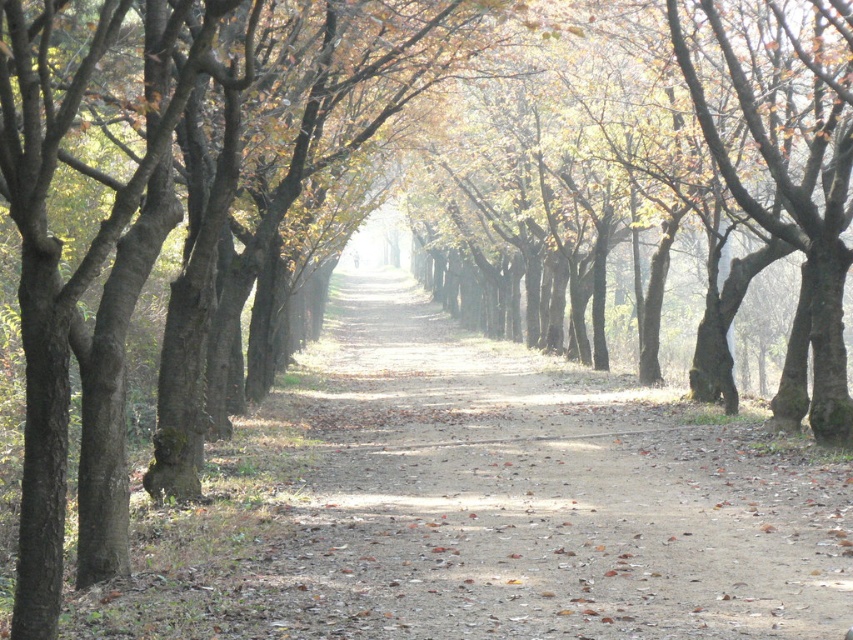
You are a hiker walking along the dirt path at center and want to take a photo of the brown smooth tree at center. Where should you position yourself relative to the tree to capture it in the frame?

The dirt path at center is located below the brown smooth tree at center, so to capture the tree in the frame, you should position yourself on the path below the tree and look upward.

You are a hiker who wants to know if you can walk along the dirt path at center without hitting the brown rough bark tree at right. Can you do that?

The dirt path at center is shorter than the brown rough bark tree at right, so the path is narrower than the tree, meaning you can walk along the dirt path at center without hitting the brown rough bark tree at right as long as you stay on the path.

You are standing at the entrance of the pathway and see two points marked on the ground. The first point is at coordinate point (718,45) and the second point is at coordinate point (850,129). Which point is closer to you?

Point (718,45) is further to the viewer than point (850,129), so the point closer to you is point (850,129).